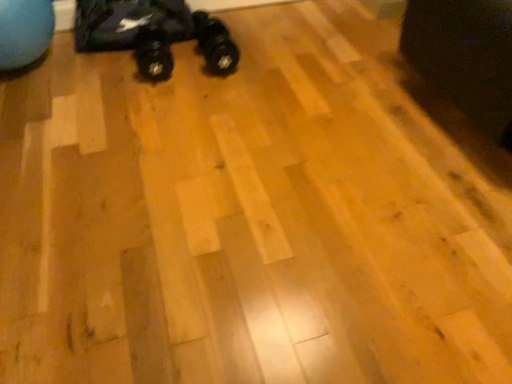
Question: Does black rubber toy car at upper left appear on the left side of black rubber shoe at center?

Choices:
 (A) yes
 (B) no

Answer: (A)

Question: Is black rubber toy car at upper left turned away from black rubber shoe at center?

Choices:
 (A) yes
 (B) no

Answer: (B)

Question: Is black rubber toy car at upper left wider than black rubber shoe at center?

Choices:
 (A) yes
 (B) no

Answer: (A)

Question: Considering the relative sizes of black rubber toy car at upper left and black rubber shoe at center in the image provided, is black rubber toy car at upper left thinner than black rubber shoe at center?

Choices:
 (A) yes
 (B) no

Answer: (B)

Question: Is black rubber toy car at upper left aimed at black rubber shoe at center?

Choices:
 (A) no
 (B) yes

Answer: (B)

Question: Considering the relative sizes of black rubber toy car at upper left and black rubber shoe at center in the image provided, is black rubber toy car at upper left smaller than black rubber shoe at center?

Choices:
 (A) yes
 (B) no

Answer: (B)

Question: Is black fabric swivel chair at upper right at the left side of black rubber toy car at upper left?

Choices:
 (A) yes
 (B) no

Answer: (B)

Question: Is the depth of black fabric swivel chair at upper right greater than that of black rubber toy car at upper left?

Choices:
 (A) no
 (B) yes

Answer: (A)

Question: From the image's perspective, is black fabric swivel chair at upper right on top of black rubber toy car at upper left?

Choices:
 (A) yes
 (B) no

Answer: (B)

Question: Is black fabric swivel chair at upper right positioned before black rubber toy car at upper left?

Choices:
 (A) no
 (B) yes

Answer: (B)

Question: Is black fabric swivel chair at upper right thinner than black rubber toy car at upper left?

Choices:
 (A) no
 (B) yes

Answer: (A)

Question: Is black fabric swivel chair at upper right at the right side of black rubber toy car at upper left?

Choices:
 (A) yes
 (B) no

Answer: (A)

Question: Is the depth of black rubber shoe at center less than that of black rubber toy car at upper left?

Choices:
 (A) no
 (B) yes

Answer: (B)